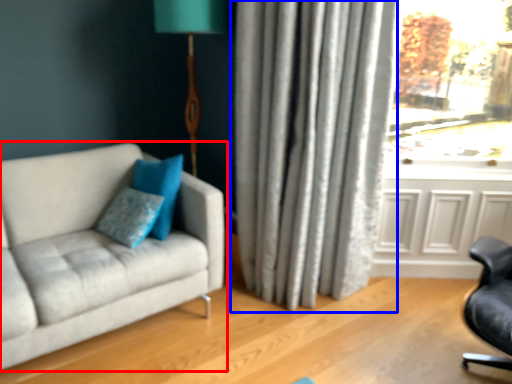
Question: Which point is closer to the camera, studio couch (highlighted by a red box) or curtain (highlighted by a blue box)?

Choices:
 (A) studio couch
 (B) curtain

Answer: (A)